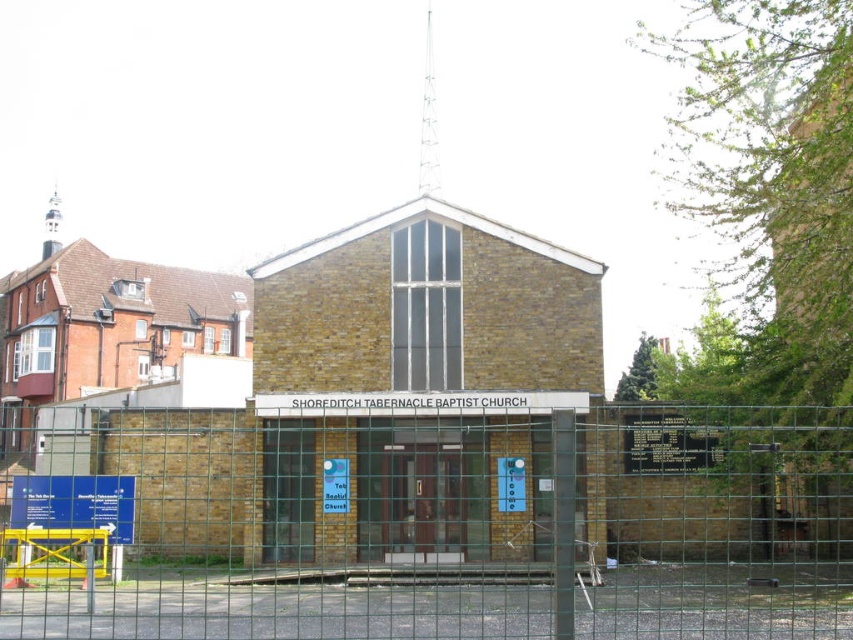
You are a delivery driver who needs to park your 2.5 meter wide truck near the Shoreditch Tabernacle Baptist Church. The only available space is between the green wire mesh fence at center and the blue plastic sign at lower left. Can your truck fit there?

The green wire mesh fence at center is wider than the blue plastic sign at lower left. Since the truck is 2.5 meters wide, it depends on the actual width of the space between them. However, since the fence is wider than the sign, the space between them might be sufficient. But without exact measurements, we can only assume it might fit if the total space between them is at least 2.5 meters.

You are a visitor approaching the Shoreditch Tabernacle Baptist Church. You see the green wire mesh fence at center and the blue plastic sign at lower left. Which object is closer to you as you approach the church?

The green wire mesh fence at center is closer to you because it is in front of the blue plastic sign at lower left.

You are standing in front of the Shoreditch Tabernacle Baptist Church and looking at its entrance. There are two points marked on the building. The first point is at coordinate point (840,502) and the second point is at coordinate point (51,499). Which point is closer to you?

Point (51,499) is closer to you because it is nearer to the camera compared to point (840,502).